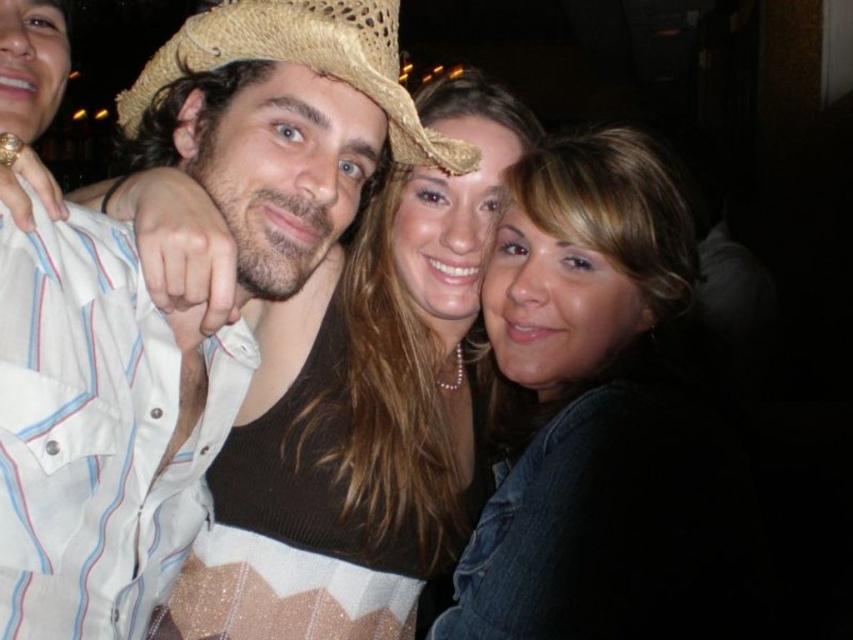
Who is shorter, brown sweater at center or strawhat at center?

strawhat at center is shorter.

Who is more forward, (368, 573) or (404, 106)?

Point (404, 106) is in front.

Does point (285, 496) lie in front of point (180, 67)?

No, (285, 496) is behind (180, 67).

The image size is (853, 640). I want to click on brown sweater at center, so click(x=370, y=413).

Which is above, matte straw hat at center or brown sweater at center?

matte straw hat at center is above.

Does matte straw hat at center have a larger size compared to brown sweater at center?

No.

Is point (83, 269) behind point (258, 611)?

No.

You are a GUI agent. You are given a task and a screenshot of the screen. Output one action in this format:
    pyautogui.click(x=<x>, y=<y>)
    Task: Click on the matte straw hat at center
    The width and height of the screenshot is (853, 640).
    Given the screenshot: What is the action you would take?
    pyautogui.click(x=99, y=432)

Does matte straw hat at center have a smaller size compared to strawhat at center?

Incorrect, matte straw hat at center is not smaller in size than strawhat at center.

Does matte straw hat at center lie in front of strawhat at center?

Yes, matte straw hat at center is in front of strawhat at center.

Identify the location of matte straw hat at center. The height and width of the screenshot is (640, 853). (99, 432).

Find the location of a particular element. The width and height of the screenshot is (853, 640). matte straw hat at center is located at coordinates (99, 432).